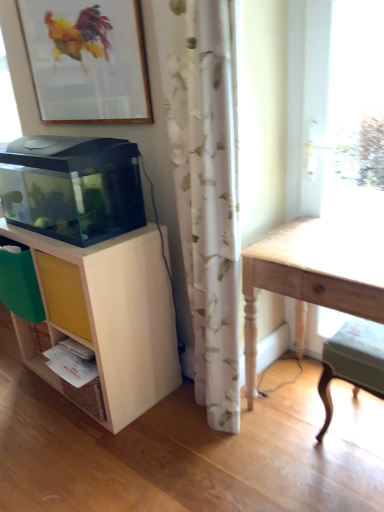
Question: Is transparent glass aquarium at left touching light wood table at right?

Choices:
 (A) yes
 (B) no

Answer: (B)

Question: Can you confirm if transparent glass aquarium at left is smaller than light wood table at right?

Choices:
 (A) no
 (B) yes

Answer: (B)

Question: From a real-world perspective, is transparent glass aquarium at left on light wood table at right?

Choices:
 (A) yes
 (B) no

Answer: (A)

Question: Is transparent glass aquarium at left facing towards light wood table at right?

Choices:
 (A) yes
 (B) no

Answer: (B)

Question: Is transparent glass aquarium at left not near light wood table at right?

Choices:
 (A) no
 (B) yes

Answer: (A)

Question: Is yellow matte drawer at lower left wider or thinner than wooden framed picture at upper left?

Choices:
 (A) wide
 (B) thin

Answer: (A)

Question: Would you say yellow matte drawer at lower left is to the left or to the right of wooden framed picture at upper left in the picture?

Choices:
 (A) left
 (B) right

Answer: (B)

Question: Is yellow matte drawer at lower left situated inside wooden framed picture at upper left or outside?

Choices:
 (A) inside
 (B) outside

Answer: (B)

Question: Considering their positions, is yellow matte drawer at lower left located in front of or behind wooden framed picture at upper left?

Choices:
 (A) behind
 (B) front

Answer: (A)

Question: Is wooden framed picture at upper left wider or thinner than light wood table at right?

Choices:
 (A) wide
 (B) thin

Answer: (B)

Question: Is wooden framed picture at upper left bigger or smaller than light wood table at right?

Choices:
 (A) big
 (B) small

Answer: (B)

Question: From the image's perspective, is wooden framed picture at upper left positioned above or below light wood table at right?

Choices:
 (A) above
 (B) below

Answer: (A)

Question: From a real-world perspective, relative to light wood table at right, is wooden framed picture at upper left vertically above or below?

Choices:
 (A) above
 (B) below

Answer: (A)

Question: From a real-world perspective, is light green fabric step stool at lower right above or below transparent glass aquarium at left?

Choices:
 (A) above
 (B) below

Answer: (B)

Question: Is point (362, 328) positioned closer to the camera than point (23, 158)?

Choices:
 (A) farther
 (B) closer

Answer: (B)